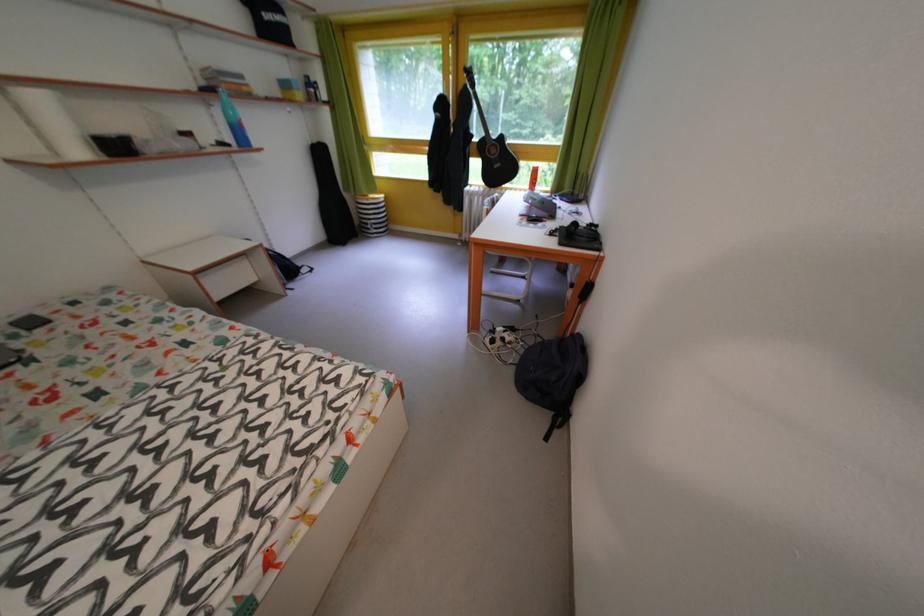
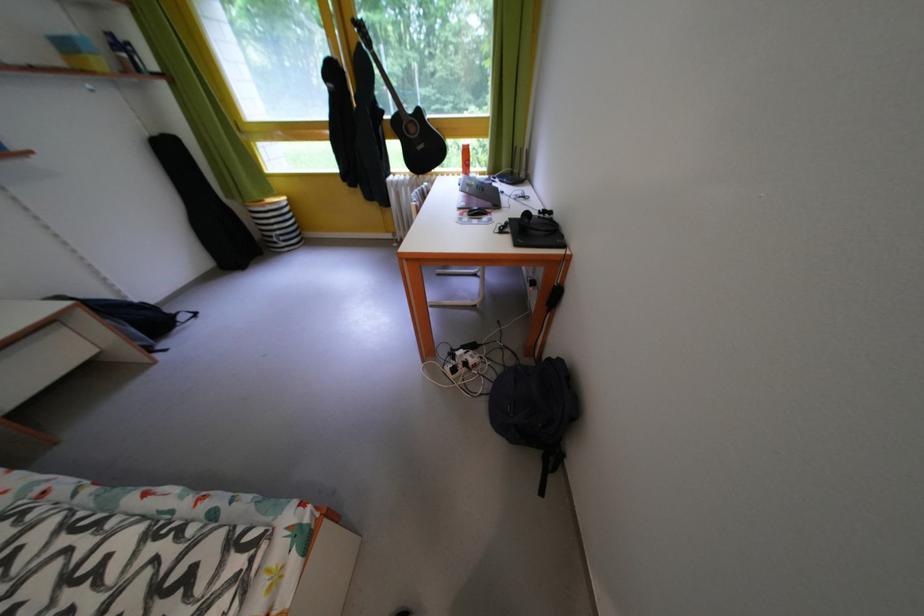
Where in the second image is the point corresponding to point 482,142 from the first image?

(393, 118)